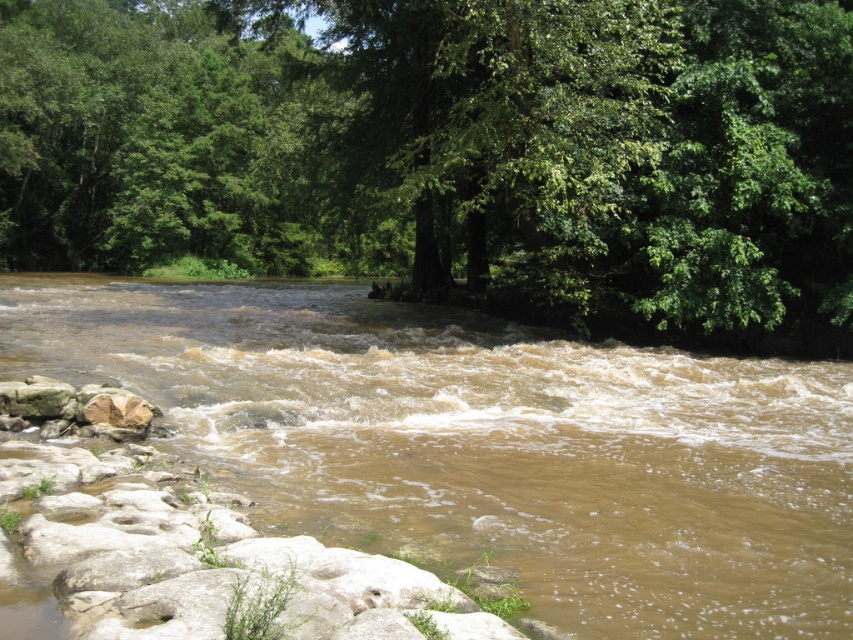
Is the position of gray rock at lower left more distant than that of brown rough rock at lower left?

That is True.

Locate an element on the screen. gray rock at lower left is located at coordinates (36, 397).

I want to click on gray rock at lower left, so click(36, 397).

Does brown muddy water at center have a greater width compared to gray rock at lower left?

Correct, the width of brown muddy water at center exceeds that of gray rock at lower left.

Does brown muddy water at center have a lesser width compared to gray rock at lower left?

In fact, brown muddy water at center might be wider than gray rock at lower left.

Does point (650, 486) come farther from viewer compared to point (39, 394)?

No.

This screenshot has height=640, width=853. I want to click on brown muddy water at center, so click(x=486, y=444).

Is point (850, 480) less distant than point (85, 416)?

Yes.

Does brown muddy water at center have a smaller size compared to brown rough rock at lower left?

Incorrect, brown muddy water at center is not smaller in size than brown rough rock at lower left.

Is point (776, 376) farther from camera compared to point (142, 401)?

Yes, point (776, 376) is behind point (142, 401).

I want to click on brown muddy water at center, so click(x=486, y=444).